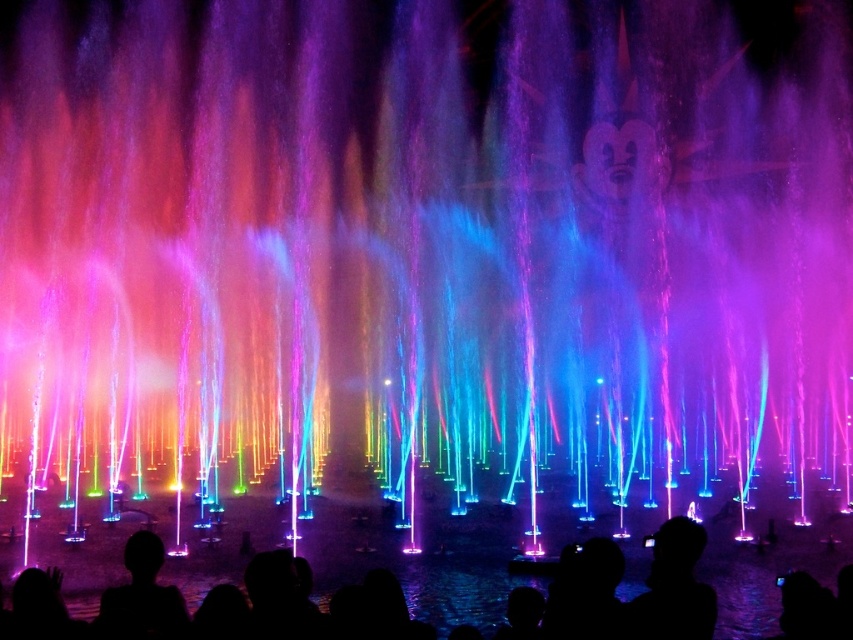
Measure the distance between silhouette head at lower center and silhouette head at lower left.

silhouette head at lower center is 15.22 meters from silhouette head at lower left.

Is silhouette head at lower center closer to camera compared to silhouette head at lower left?

That is False.

Find the location of a particular element. This screenshot has width=853, height=640. silhouette head at lower center is located at coordinates (421, 564).

The width and height of the screenshot is (853, 640). I want to click on silhouette head at center, so click(672, 588).

What do you see at coordinates (672, 588) in the screenshot? I see `silhouette head at center` at bounding box center [672, 588].

Find the location of `silhouette head at center`. silhouette head at center is located at coordinates (672, 588).

Between point (42, 525) and point (656, 636), which one is positioned behind?

The point (42, 525) is more distant.

How distant is silhouette head at lower center from silhouette head at center?

silhouette head at lower center is 46.31 feet away from silhouette head at center.

Locate an element on the screen. This screenshot has width=853, height=640. silhouette head at lower center is located at coordinates click(421, 564).